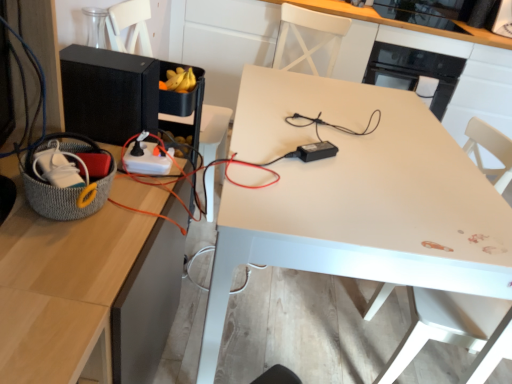
Question: Is black plastic power adapter at center, the second appliance positioned from the right, to the right of knitted gray basket at left from the viewer's perspective?

Choices:
 (A) no
 (B) yes

Answer: (B)

Question: Does black plastic power adapter at center, which ranks as the first appliance in bottom-to-top order, turn towards knitted gray basket at left?

Choices:
 (A) yes
 (B) no

Answer: (B)

Question: Does black plastic power adapter at center, positioned as the second appliance in left-to-right order, contain knitted gray basket at left?

Choices:
 (A) yes
 (B) no

Answer: (B)

Question: Does black plastic power adapter at center, which ranks as the first appliance in bottom-to-top order, have a lesser height compared to knitted gray basket at left?

Choices:
 (A) no
 (B) yes

Answer: (B)

Question: Is black plastic power adapter at center, marked as the third appliance in a top-to-bottom arrangement, to the left of knitted gray basket at left from the viewer's perspective?

Choices:
 (A) no
 (B) yes

Answer: (A)

Question: Is black glossy microwave at upper right, the 3th appliance when ordered from front to back, in front of or behind black matte speaker at left, placed as the 2th appliance when sorted from front to back, in the image?

Choices:
 (A) behind
 (B) front

Answer: (A)

Question: From a real-world perspective, is black glossy microwave at upper right, which is the 1th appliance in back-to-front order, positioned above or below black matte speaker at left, the 2th appliance viewed from the top?

Choices:
 (A) above
 (B) below

Answer: (B)

Question: Is point (452, 61) positioned closer to the camera than point (124, 122)?

Choices:
 (A) closer
 (B) farther

Answer: (B)

Question: In the image, is black glossy microwave at upper right, the 3th appliance positioned from the bottom, on the left side or the right side of black matte speaker at left, placed as the 2th appliance when sorted from front to back?

Choices:
 (A) left
 (B) right

Answer: (B)

Question: From the image's perspective, is black matte speaker at left, the 1th appliance from the left, located above or below knitted gray basket at left?

Choices:
 (A) above
 (B) below

Answer: (A)

Question: Do you think black matte speaker at left, placed as the 2th appliance when sorted from back to front, is within knitted gray basket at left, or outside of it?

Choices:
 (A) inside
 (B) outside

Answer: (B)

Question: In terms of height, does black matte speaker at left, the 2th appliance in the bottom-to-top sequence, look taller or shorter compared to knitted gray basket at left?

Choices:
 (A) tall
 (B) short

Answer: (A)

Question: Does point (117, 127) appear closer or farther from the camera than point (35, 188)?

Choices:
 (A) closer
 (B) farther

Answer: (B)

Question: Is black glossy microwave at upper right, the 3th appliance positioned from the bottom, bigger or smaller than white plastic swivel chair at center?

Choices:
 (A) small
 (B) big

Answer: (A)

Question: Considering the positions of black glossy microwave at upper right, marked as the third appliance in a left-to-right arrangement, and white plastic swivel chair at center in the image, is black glossy microwave at upper right, marked as the third appliance in a left-to-right arrangement, wider or thinner than white plastic swivel chair at center?

Choices:
 (A) wide
 (B) thin

Answer: (A)